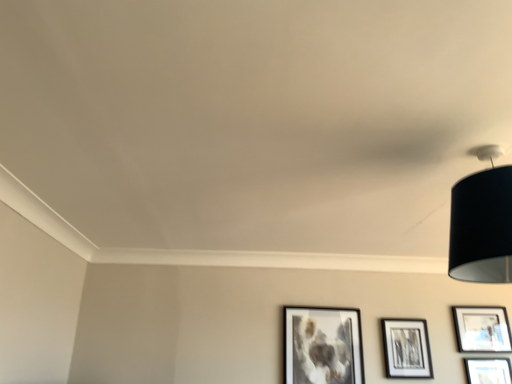
Question: Is point (470, 377) closer or farther from the camera than point (301, 312)?

Choices:
 (A) closer
 (B) farther

Answer: (A)

Question: In the image, is matte black picture frame at lower right, positioned as the 2th picture frame in right-to-left order, positioned in front of or behind matte black picture frame at lower center, placed as the fourth picture frame when sorted from right to left?

Choices:
 (A) front
 (B) behind

Answer: (A)

Question: Which object is positioned farthest from the matte black picture frame at lower right, arranged as the fourth picture frame when viewed from the left?

Choices:
 (A) matte black picture frame at lower right, the third picture frame viewed from the left
 (B) black fabric lampshade at upper right
 (C) matte black picture frame at lower center, which is counted as the 1th picture frame, starting from the left
 (D) matte black picture frame at center right, placed as the 2th picture frame when sorted from left to right

Answer: (B)

Question: Which is nearer to the matte black picture frame at lower right, arranged as the fourth picture frame when viewed from the left?

Choices:
 (A) matte black picture frame at center right, which is the 3th picture frame in right-to-left order
 (B) black fabric lampshade at upper right
 (C) matte black picture frame at lower right, positioned as the 2th picture frame in right-to-left order
 (D) matte black picture frame at lower center, which is counted as the 1th picture frame, starting from the left

Answer: (C)